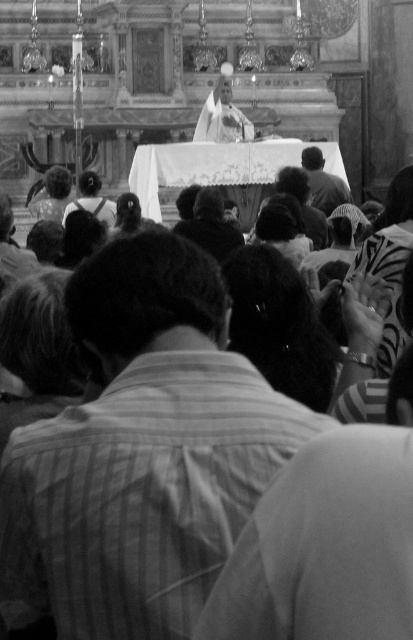
You are an artist trying to sketch this scene. You notice two elements in the image, the striped fabric shirt at center and the dark hair at upper center. Which of these two elements would require more space on your sketch paper to accurately depict their details?

The striped fabric shirt at center is bigger than the dark hair at upper center, so it would require more space on the sketch paper to accurately depict its details.

You are a photographer taking pictures of the congregation during the service. You notice two distinct features in your viewfinder, the striped fabric shirt at center and the dark hair at upper center. Which of these two features is located more to the left in the image?

The striped fabric shirt at center is positioned on the left side of dark hair at upper center, so the striped fabric shirt at center is more to the left.